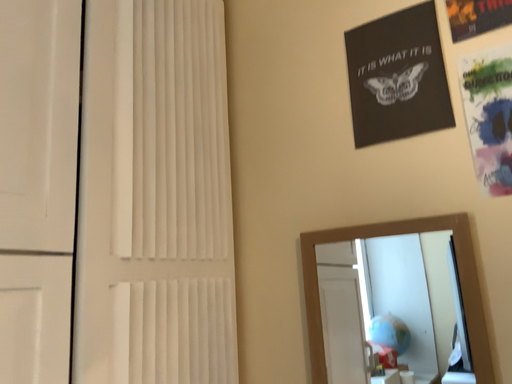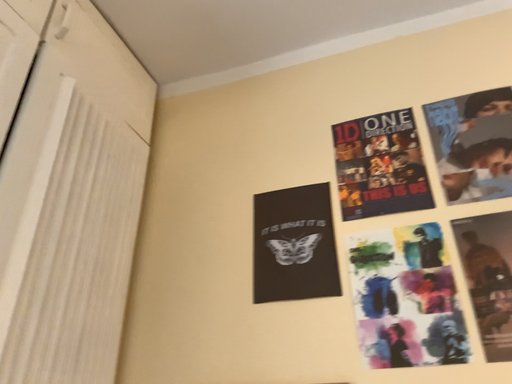
Question: How did the camera likely rotate when shooting the video?

Choices:
 (A) rotated right
 (B) rotated left

Answer: (A)